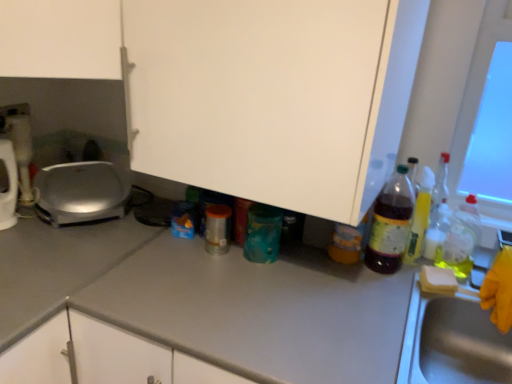
This screenshot has width=512, height=384. What are the coordinates of `free location to the right of yellow sponge at right` in the screenshot? It's located at (473, 285).